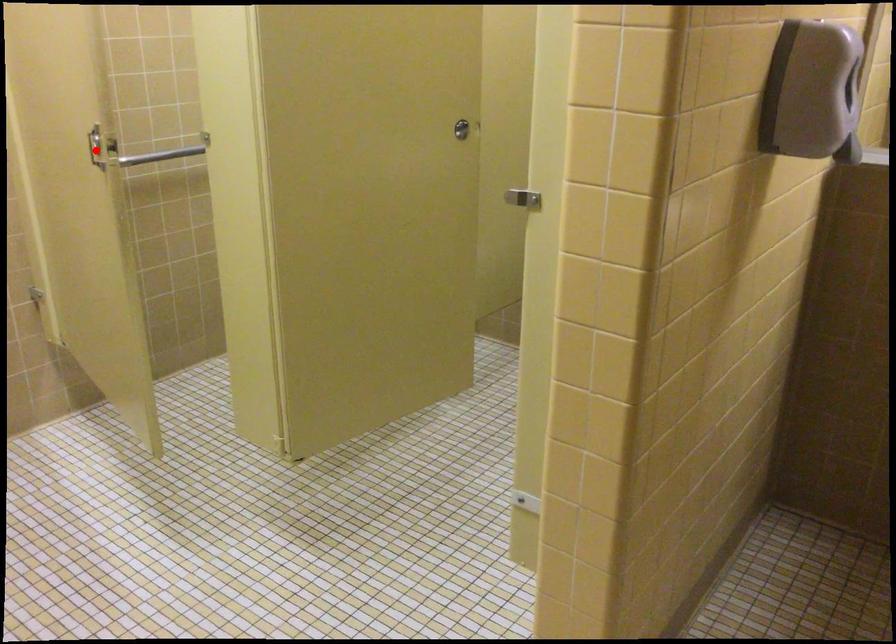
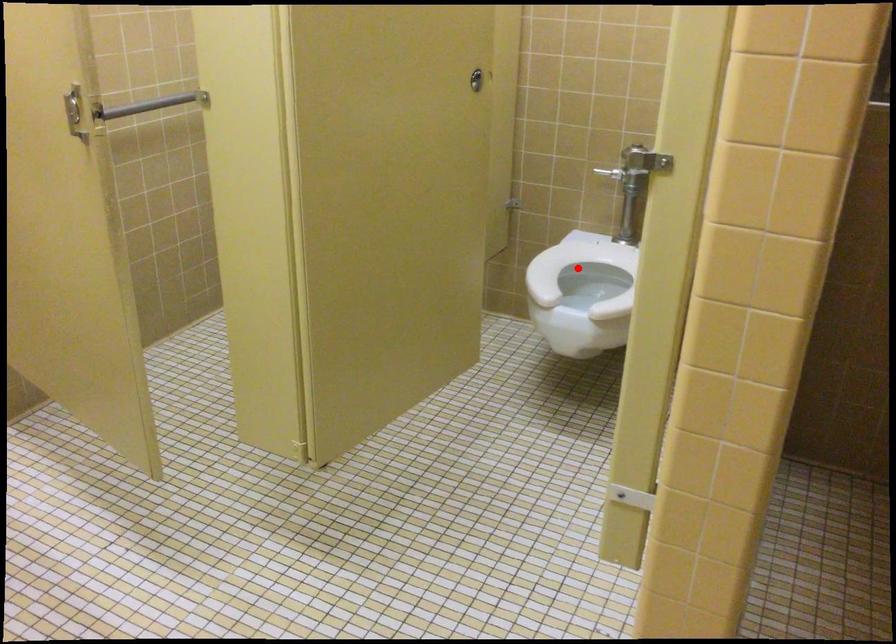
I am providing you with two images of the same scene from different viewpoints. A red point is marked on the first image and another point is marked on the second image. Do the highlighted points in image1 and image2 indicate the same real-world spot?

No